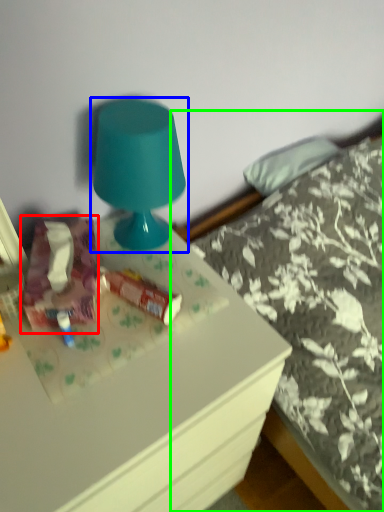
Question: Which object is positioned farthest from stuff (highlighted by a red box)? Select from lamp (highlighted by a blue box) and bed (highlighted by a green box).

Choices:
 (A) lamp
 (B) bed

Answer: (B)